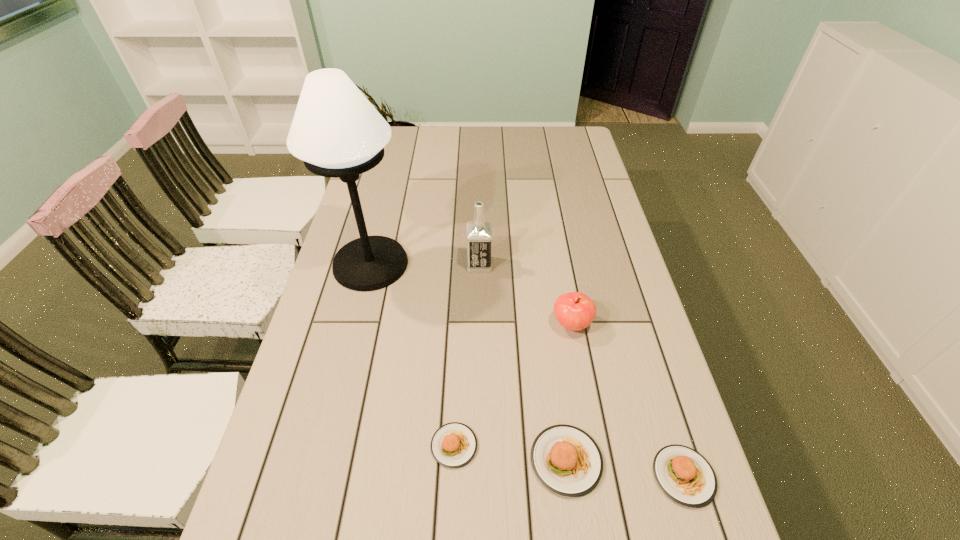
Please point a spot to add another food on the left. Please provide its 2D coordinates. Your answer should be formatted as a tuple, i.e. [(x, y)], where the tuple contains the x and y coordinates of a point satisfying the conditions above.

[(348, 431)]